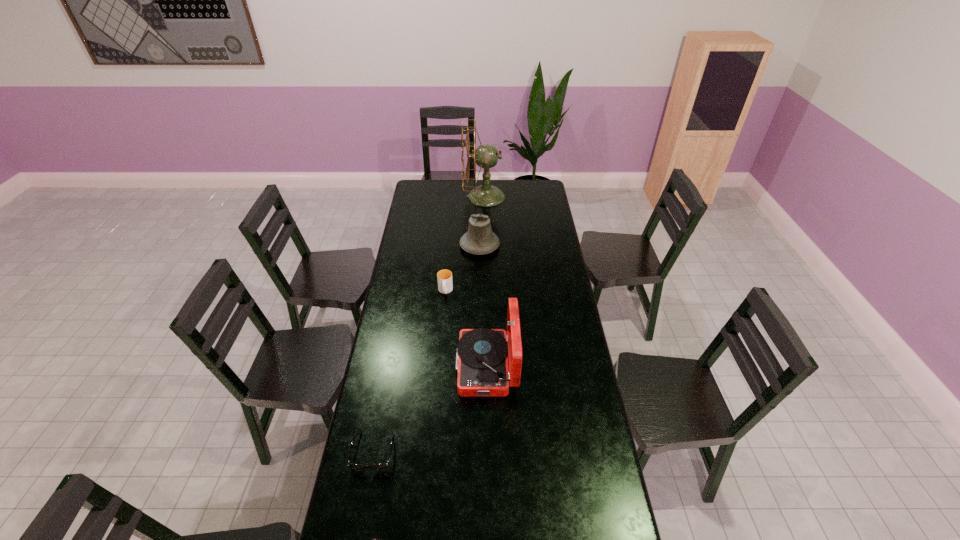
Locate which object is the third closest to the farthest object. Please provide its 2D coordinates. Your answer should be formatted as a tuple, i.e. [(x, y)], where the tuple contains the x and y coordinates of a point satisfying the conditions above.

[(482, 364)]

At what (x,y) coordinates should I click in order to perform the action: click on free location that satisfies the following two spatial constraints: 1. on the front-facing side of the third nearest object; 2. on the lenses of the spectacles. Please return your answer as a coordinate pair (x, y). Looking at the image, I should click on point(488,451).

Where is `vacant space that satisfies the following two spatial constraints: 1. in front of the tallest object, directing air flow; 2. with the handle on the side of the fourth tallest object`? vacant space that satisfies the following two spatial constraints: 1. in front of the tallest object, directing air flow; 2. with the handle on the side of the fourth tallest object is located at coordinates (486, 291).

Where is `vacant region that satisfies the following two spatial constraints: 1. in front of the tallest object, directing air flow; 2. on the lenses of the fifth farthest object`? The image size is (960, 540). vacant region that satisfies the following two spatial constraints: 1. in front of the tallest object, directing air flow; 2. on the lenses of the fifth farthest object is located at coordinates (488, 451).